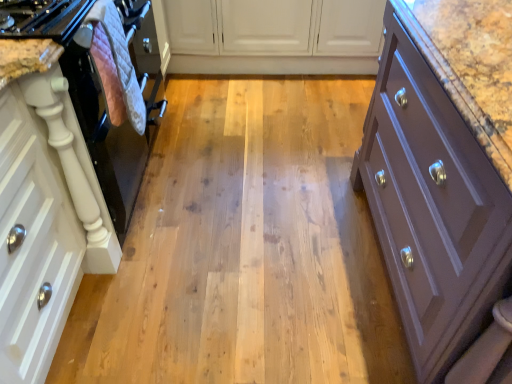
Question: Looking at their shapes, would you say white matte cabinet at center, which is the 2th cabinetry in right-to-left order, is wider or thinner than white matte cabinet at left, which is counted as the first cabinetry, starting from the left?

Choices:
 (A) wide
 (B) thin

Answer: (A)

Question: Based on their sizes in the image, would you say white matte cabinet at center, the second cabinetry from the left, is bigger or smaller than white matte cabinet at left, which is counted as the third cabinetry, starting from the right?

Choices:
 (A) big
 (B) small

Answer: (A)

Question: Considering the real-world distances, which object is farthest from the purple matte cabinet at right, the 1th cabinetry when ordered from right to left?

Choices:
 (A) pink quilted oven mitt at left
 (B) white matte cabinet at left, which is counted as the first cabinetry, starting from the left
 (C) white matte cabinet at center, which is the 2th cabinetry in right-to-left order
 (D) black glossy oven at left

Answer: (C)

Question: Which is farther from the white matte cabinet at center, the second cabinetry from the left?

Choices:
 (A) white matte cabinet at left, which is counted as the third cabinetry, starting from the right
 (B) purple matte cabinet at right, the 1th cabinetry when ordered from right to left
 (C) black glossy oven at left
 (D) pink quilted oven mitt at left

Answer: (A)